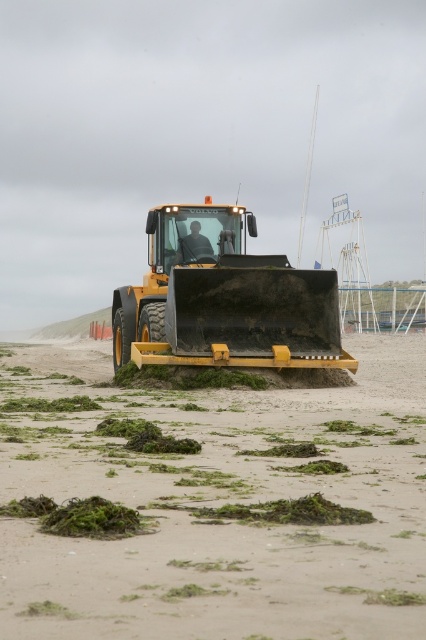
Question: Does yellow rubber tractor at center have a larger size compared to yellow matte plow at center?

Choices:
 (A) yes
 (B) no

Answer: (A)

Question: Does yellow rubber tractor at center have a greater width compared to yellow matte plow at center?

Choices:
 (A) yes
 (B) no

Answer: (A)

Question: Which object is farther from the camera taking this photo?

Choices:
 (A) yellow matte plow at center
 (B) yellow rubber tractor at center

Answer: (A)

Question: Which of the following is the farthest from the observer?

Choices:
 (A) (189, 256)
 (B) (127, 560)

Answer: (A)

Question: Is yellow rubber tractor at center bigger than yellow matte plow at center?

Choices:
 (A) no
 (B) yes

Answer: (B)